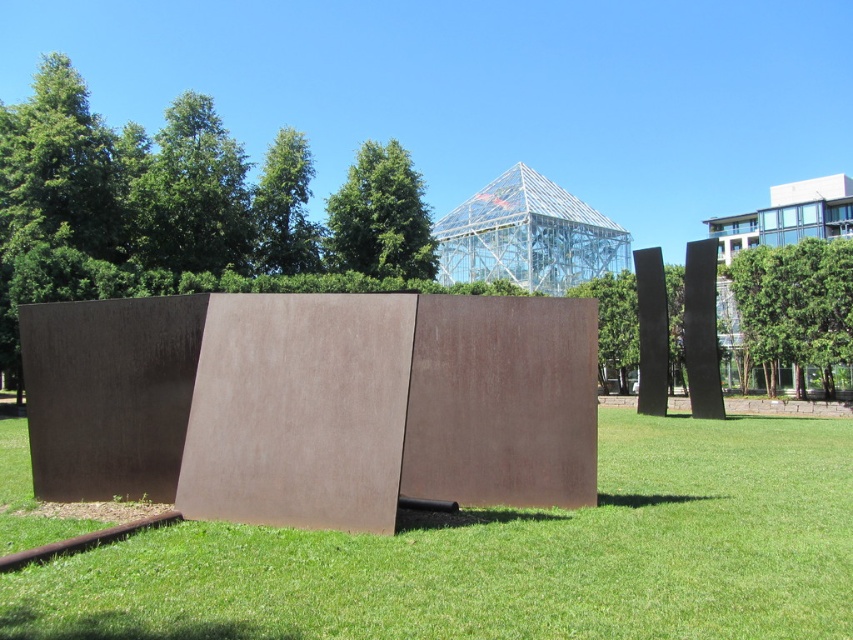
Question: Does green grass at center appear under transparent glass pyramid at upper center?

Choices:
 (A) yes
 (B) no

Answer: (A)

Question: Can you confirm if green grass at center is smaller than transparent glass pyramid at upper center?

Choices:
 (A) yes
 (B) no

Answer: (A)

Question: Which point is farther to the camera?

Choices:
 (A) (532, 188)
 (B) (674, 436)

Answer: (A)

Question: Is green grass at center above transparent glass pyramid at upper center?

Choices:
 (A) yes
 (B) no

Answer: (B)